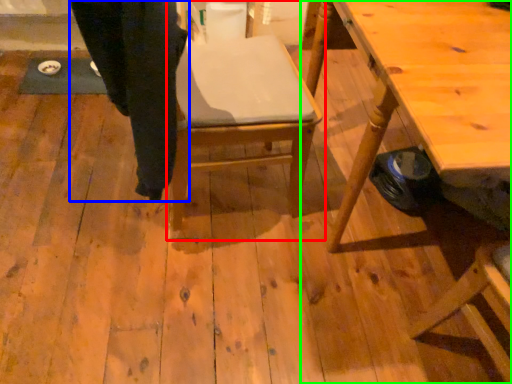
Question: Which object is the farthest from chair (highlighted by a red box)? Choose among these: trousers (highlighted by a blue box) or table (highlighted by a green box).

Choices:
 (A) trousers
 (B) table

Answer: (B)